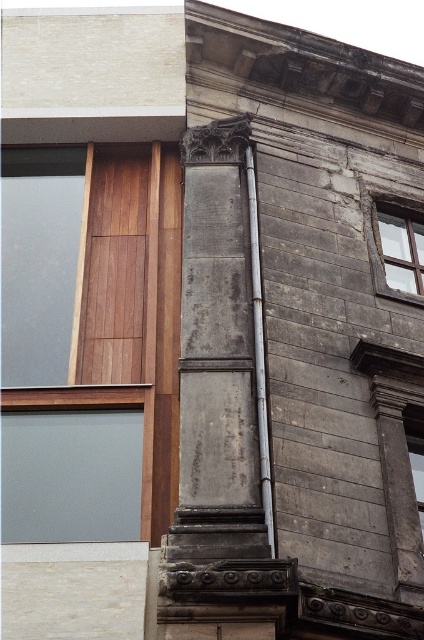
Who is higher up, matte gray stone window at upper right or metallic pipe at center?

matte gray stone window at upper right is above.

Locate an element on the screen. matte gray stone window at upper right is located at coordinates (395, 244).

Find the location of a particular element. Image resolution: width=424 pixels, height=640 pixels. matte gray stone window at upper right is located at coordinates (395, 244).

Find the location of `matte gray stone window at upper right`. matte gray stone window at upper right is located at coordinates (395, 244).